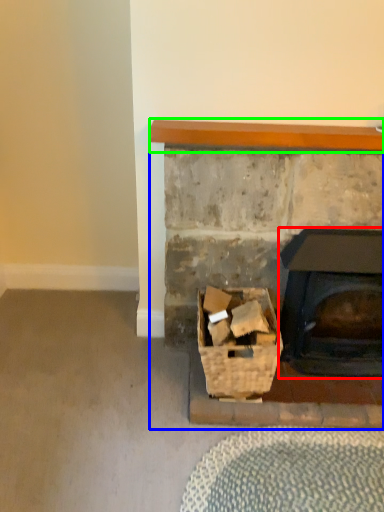
Question: Which is nearer to the wood burning stove (highlighted by a red box)? fireplace (highlighted by a blue box) or balustrade (highlighted by a green box).

Choices:
 (A) fireplace
 (B) balustrade

Answer: (A)